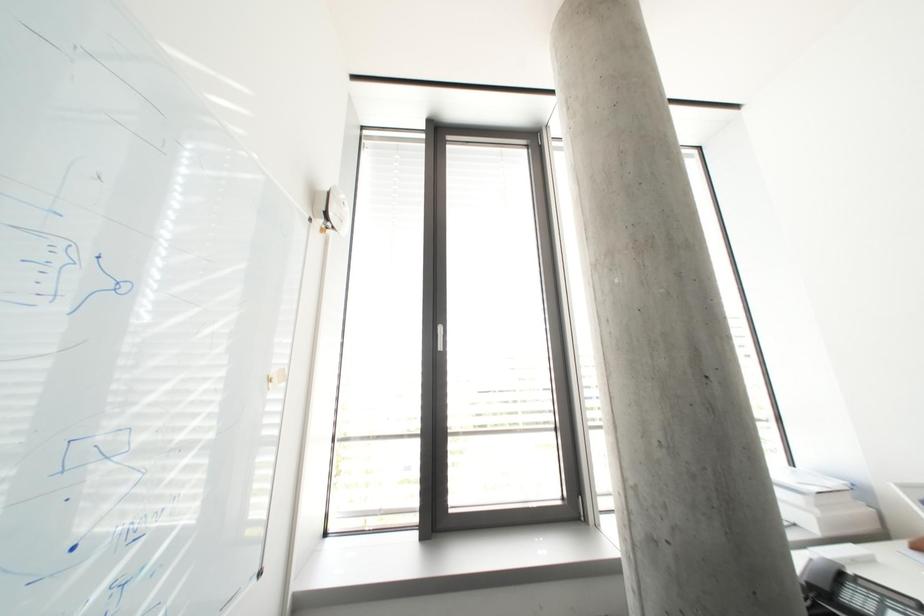
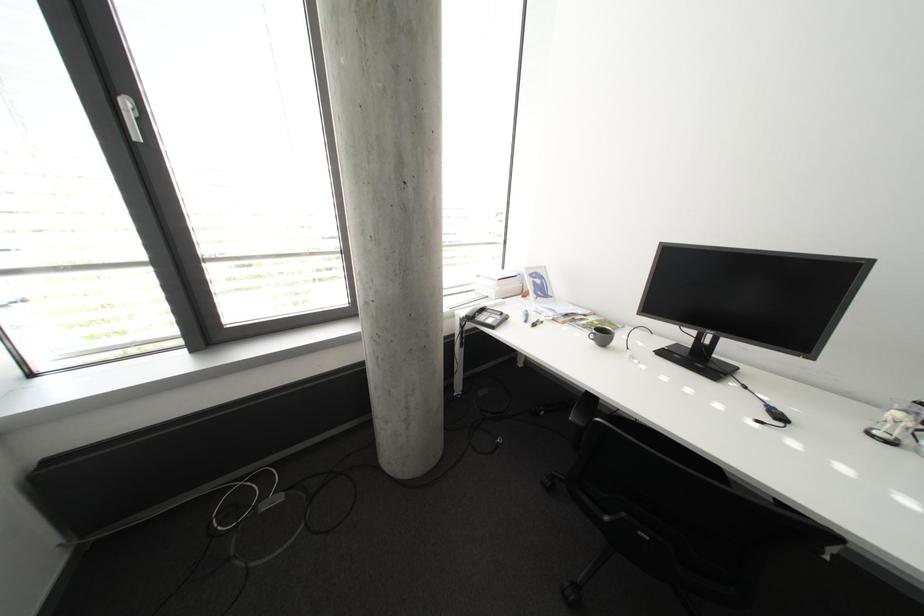
First-person continuous shooting, in which direction is the camera rotating?

The camera's rotation is toward right-down.